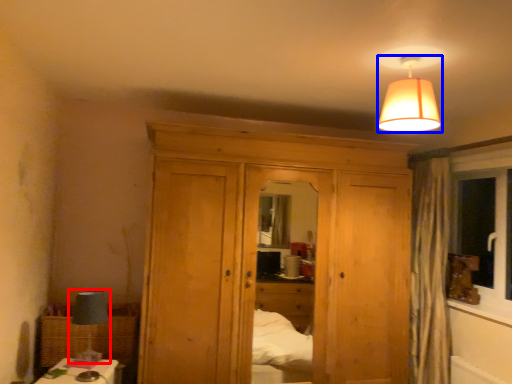
Question: Which point is closer to the camera, table lamp (highlighted by a red box) or lamp (highlighted by a blue box)?

Choices:
 (A) table lamp
 (B) lamp

Answer: (B)